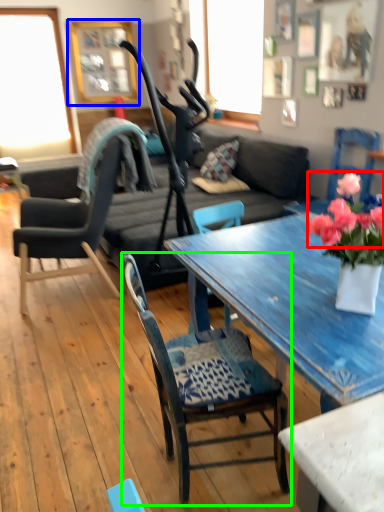
Question: Estimate the real-world distances between objects in this image. Which object is farther from flower (highlighted by a red box), picture frame (highlighted by a blue box) or chair (highlighted by a green box)?

Choices:
 (A) picture frame
 (B) chair

Answer: (A)